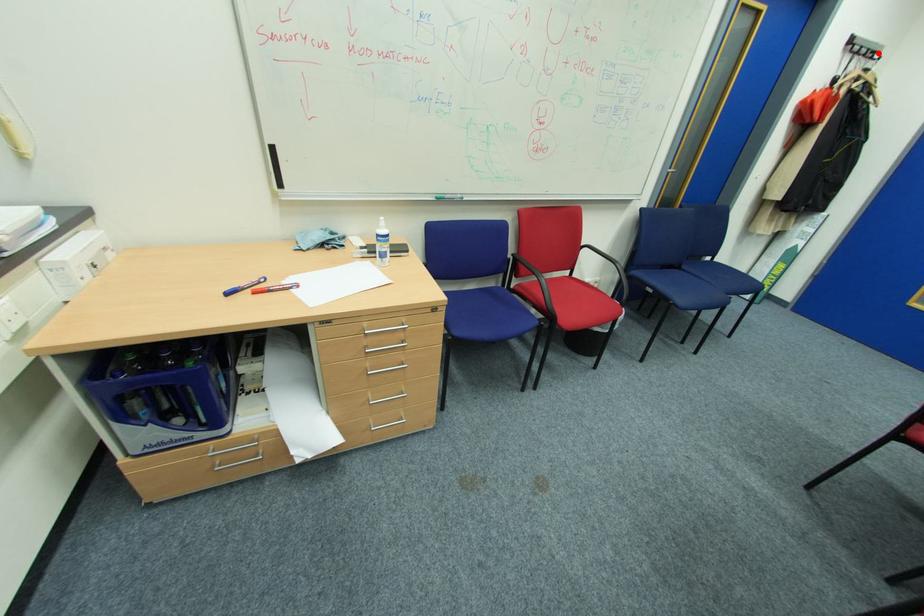
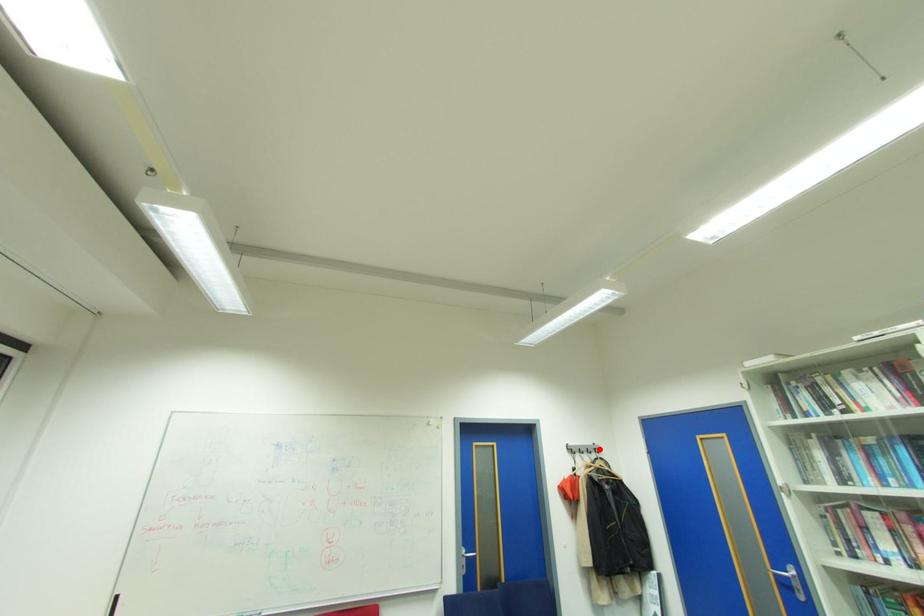
I am providing you with two images of the same scene from different viewpoints. A red point is marked on the first image and another point is marked on the second image. Is the marked point in image1 the same physical position as the marked point in image2?

Yes